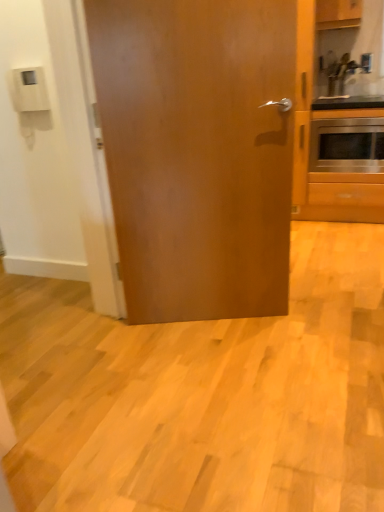
Consider the image. Measure the distance between point [320,68] and camera.

Point [320,68] is 3.46 meters away from camera.

The image size is (384, 512). I want to click on metallic silver sink at upper right, so click(x=346, y=84).

Find the location of a particular element. Image resolution: width=384 pixels, height=512 pixels. stainless steel oven at right is located at coordinates (347, 145).

Could stainless steel oven at right be considered to be inside metallic silver sink at upper right?

No, stainless steel oven at right is located outside of metallic silver sink at upper right.

Between metallic silver sink at upper right and stainless steel oven at right, which one is positioned behind?

metallic silver sink at upper right is behind.

In terms of size, does metallic silver sink at upper right appear bigger or smaller than stainless steel oven at right?

metallic silver sink at upper right is smaller than stainless steel oven at right.

From a real-world perspective, is metallic silver sink at upper right above or below stainless steel oven at right?

Clearly, from a real-world perspective, metallic silver sink at upper right is above stainless steel oven at right.

You are a GUI agent. You are given a task and a screenshot of the screen. Output one action in this format:
    pyautogui.click(x=<x>, y=<y>)
    Task: Click on the cabinetry above the glossy wood door at center (from the image's perspective)
    Image resolution: width=384 pixels, height=512 pixels.
    Given the screenshot: What is the action you would take?
    pyautogui.click(x=338, y=13)

Between glossy wood door at center and wooden cabinet at upper right, which one is positioned behind?

Positioned behind is wooden cabinet at upper right.

Could you tell me if glossy wood door at center is turned towards wooden cabinet at upper right?

No, glossy wood door at center is not aimed at wooden cabinet at upper right.

From a real-world perspective, is stainless steel oven at right physically located above or below glossy wood door at center?

stainless steel oven at right is below glossy wood door at center.

Is stainless steel oven at right in contact with glossy wood door at center?

No, stainless steel oven at right is not beside glossy wood door at center.

From the image's perspective, which is above, stainless steel oven at right or glossy wood door at center?

stainless steel oven at right, from the image's perspective.

Considering the sizes of objects stainless steel oven at right and glossy wood door at center in the image provided, who is bigger, stainless steel oven at right or glossy wood door at center?

Bigger between the two is glossy wood door at center.

Visually, is stainless steel oven at right positioned to the left or to the right of metallic silver sink at upper right?

Clearly, stainless steel oven at right is on the right of metallic silver sink at upper right in the image.

Is point (365, 119) closer to viewer compared to point (362, 68)?

That is True.

From a real-world perspective, between stainless steel oven at right and metallic silver sink at upper right, who is vertically lower?

stainless steel oven at right.

Is metallic silver sink at upper right at the back of stainless steel oven at right?

No, stainless steel oven at right is not facing away from metallic silver sink at upper right.

Is wooden cabinet at upper right spatially inside stainless steel oven at right, or outside of it?

wooden cabinet at upper right is located beyond the bounds of stainless steel oven at right.

Can you tell me how much wooden cabinet at upper right and stainless steel oven at right differ in facing direction?

0.41 degrees separate the facing orientations of wooden cabinet at upper right and stainless steel oven at right.

Is wooden cabinet at upper right facing towards stainless steel oven at right?

No, wooden cabinet at upper right is not aimed at stainless steel oven at right.

Considering the sizes of wooden cabinet at upper right and stainless steel oven at right in the image, is wooden cabinet at upper right taller or shorter than stainless steel oven at right?

In the image, wooden cabinet at upper right appears to be shorter than stainless steel oven at right.

From the image's perspective, is metallic silver sink at upper right on glossy wood door at center?

Yes, from the image's perspective, metallic silver sink at upper right is over glossy wood door at center.

This screenshot has width=384, height=512. I want to click on door located in front of the metallic silver sink at upper right, so click(x=200, y=149).

Which of these two, metallic silver sink at upper right or glossy wood door at center, is wider?

metallic silver sink at upper right is wider.

Is metallic silver sink at upper right not inside glossy wood door at center?

Yes, metallic silver sink at upper right is located beyond the bounds of glossy wood door at center.

From the image's perspective, which is above, metallic silver sink at upper right or wooden cabinet at upper right?

wooden cabinet at upper right, from the image's perspective.

Considering the sizes of objects metallic silver sink at upper right and wooden cabinet at upper right in the image provided, who is bigger, metallic silver sink at upper right or wooden cabinet at upper right?

Bigger between the two is wooden cabinet at upper right.

Which object is positioned more to the left, metallic silver sink at upper right or wooden cabinet at upper right?

wooden cabinet at upper right.

How many degrees apart are the facing directions of metallic silver sink at upper right and wooden cabinet at upper right?

There is a 1.26-degree angle between the facing directions of metallic silver sink at upper right and wooden cabinet at upper right.

At what (x,y) coordinates should I click in order to perform the action: click on sink above the stainless steel oven at right (from the image's perspective). Please return your answer as a coordinate pair (x, y). Looking at the image, I should click on coord(346,84).

Find the location of a particular element. This screenshot has width=384, height=512. cabinetry above the glossy wood door at center (from a real-world perspective) is located at coordinates (338, 13).

Considering their positions, is metallic silver sink at upper right positioned closer to wooden cabinet at upper right than stainless steel oven at right?

metallic silver sink at upper right lies closer to wooden cabinet at upper right than the other object.

From the image, which object appears to be farther from glossy wood door at center, wooden cabinet at upper right or metallic silver sink at upper right?

wooden cabinet at upper right lies further to glossy wood door at center than the other object.

Which object lies nearer to the anchor point stainless steel oven at right, glossy wood door at center or metallic silver sink at upper right?

metallic silver sink at upper right is positioned closer to the anchor stainless steel oven at right.

In the scene shown: From the image, which object appears to be farther from metallic silver sink at upper right, glossy wood door at center or stainless steel oven at right?

glossy wood door at center.

Which object lies nearer to the anchor point glossy wood door at center, stainless steel oven at right or metallic silver sink at upper right?

stainless steel oven at right.

Which object lies further to the anchor point metallic silver sink at upper right, stainless steel oven at right or wooden cabinet at upper right?

The object further to metallic silver sink at upper right is wooden cabinet at upper right.

When comparing their distances from wooden cabinet at upper right, does stainless steel oven at right or glossy wood door at center seem closer?

stainless steel oven at right is positioned closer to the anchor wooden cabinet at upper right.

Which object lies nearer to the anchor point glossy wood door at center, wooden cabinet at upper right or stainless steel oven at right?

stainless steel oven at right.

What are the coordinates of `sink between wooden cabinet at upper right and stainless steel oven at right in the up-down direction` in the screenshot? It's located at (346, 84).

Where is `cabinetry between glossy wood door at center and stainless steel oven at right in the front-back direction`? This screenshot has height=512, width=384. cabinetry between glossy wood door at center and stainless steel oven at right in the front-back direction is located at coordinates (338, 13).

What are the coordinates of `cabinetry between glossy wood door at center and metallic silver sink at upper right in the front-back direction` in the screenshot? It's located at (338, 13).

You are a GUI agent. You are given a task and a screenshot of the screen. Output one action in this format:
    pyautogui.click(x=<x>, y=<y>)
    Task: Click on the oven positioned between glossy wood door at center and metallic silver sink at upper right from near to far
    The height and width of the screenshot is (512, 384).
    Given the screenshot: What is the action you would take?
    pyautogui.click(x=347, y=145)